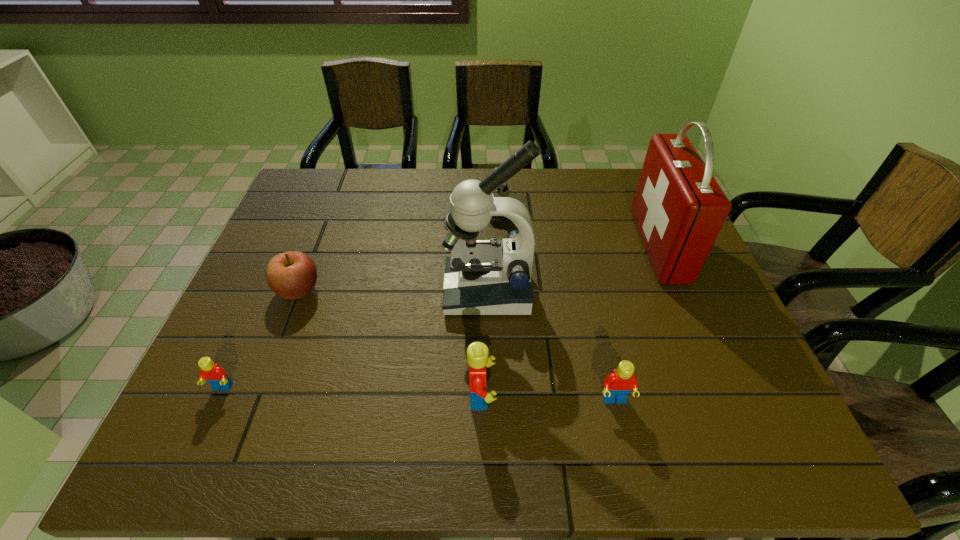
You are a GUI agent. You are given a task and a screenshot of the screen. Output one action in this format:
    pyautogui.click(x=<x>, y=<y>)
    Task: Click on the vacant space located on the face of the second Lego from right to left
    The width and height of the screenshot is (960, 540).
    Given the screenshot: What is the action you would take?
    pyautogui.click(x=563, y=396)

Identify the location of vacant area situated on the back of the microphone. (479, 194).

Identify the location of blank space located on the front face of the rightmost object. (603, 245).

Where is `vacant region located on the front face of the rightmost object`? This screenshot has height=540, width=960. vacant region located on the front face of the rightmost object is located at coordinates (528, 245).

Image resolution: width=960 pixels, height=540 pixels. What are the coordinates of `free space located on the front face of the rightmost object` in the screenshot? It's located at (570, 245).

Find the location of `free point located on the back of the apple`. free point located on the back of the apple is located at coordinates (336, 194).

You are a GUI agent. You are given a task and a screenshot of the screen. Output one action in this format:
    pyautogui.click(x=<x>, y=<y>)
    Task: Click on the vacant space situated 0.310m on the left of the microscope
    
    Given the screenshot: What is the action you would take?
    point(324,291)

At what (x,y) coordinates should I click in order to perform the action: click on microphone present at the far edge. Please return your answer as a coordinate pair (x, y). The image size is (960, 540). Looking at the image, I should click on (503, 191).

I want to click on the first-aid kit located at the far edge, so click(679, 208).

In order to click on Lego present at the left edge in this screenshot , I will do [x=215, y=375].